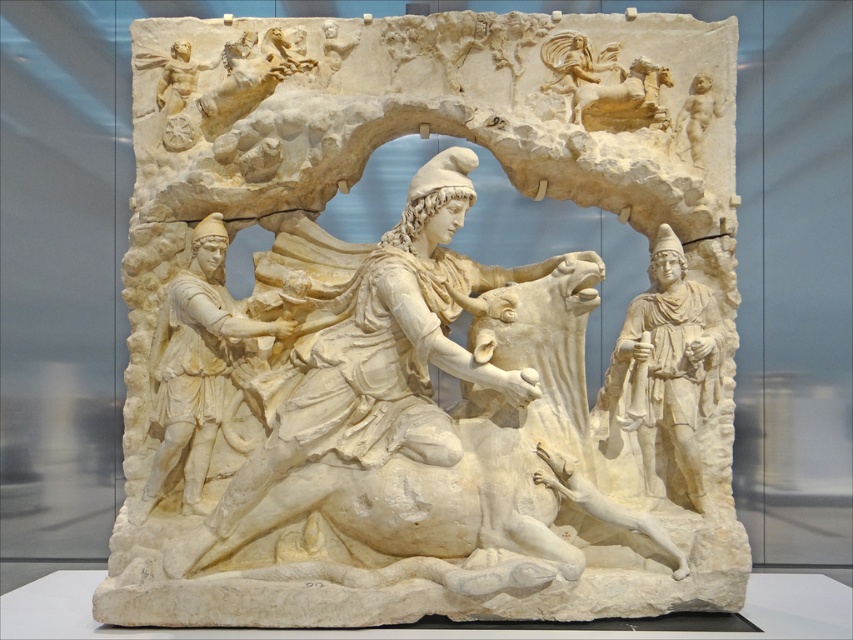
How much distance is there between white marble sculpture at center and white marble figure at center?

white marble sculpture at center is 13.79 inches from white marble figure at center.

Who is shorter, white marble sculpture at center or white marble figure at center?

With less height is white marble figure at center.

What do you see at coordinates (422, 328) in the screenshot?
I see `white marble sculpture at center` at bounding box center [422, 328].

Locate an element on the screen. This screenshot has height=640, width=853. white marble sculpture at center is located at coordinates (422, 328).

Is point (538, 285) positioned behind point (178, 342)?

That is False.

Is point (637, 611) less distant than point (184, 404)?

Yes, it is.

Locate an element on the screen. The height and width of the screenshot is (640, 853). white marble sculpture at center is located at coordinates (422, 328).

Where is `white marble sculpture at center`? white marble sculpture at center is located at coordinates pyautogui.click(x=422, y=328).

Can you confirm if white marble sculpture at center is positioned above smooth beige cherub at upper right?

Actually, white marble sculpture at center is below smooth beige cherub at upper right.

The width and height of the screenshot is (853, 640). What do you see at coordinates (422, 328) in the screenshot?
I see `white marble sculpture at center` at bounding box center [422, 328].

In the scene shown: Who is more forward, (611, 612) or (712, 84)?

Positioned in front is point (611, 612).

This screenshot has height=640, width=853. What are the coordinates of `white marble sculpture at center` in the screenshot? It's located at (422, 328).